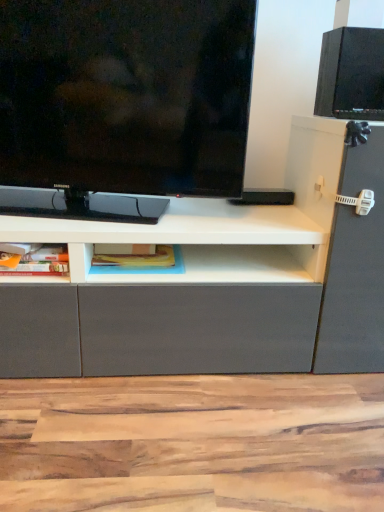
Question: Could blue matte bookshelf at center, the first cabinet positioned from the right, be considered to be inside matte black tv at upper left?

Choices:
 (A) yes
 (B) no

Answer: (B)

Question: Is matte black tv at upper left not close to blue matte bookshelf at center, the first cabinet positioned from the right?

Choices:
 (A) no
 (B) yes

Answer: (A)

Question: Could you tell me if matte black tv at upper left is turned towards blue matte bookshelf at center, acting as the 2th cabinet starting from the left?

Choices:
 (A) yes
 (B) no

Answer: (B)

Question: Is matte black tv at upper left not inside blue matte bookshelf at center, the first cabinet positioned from the right?

Choices:
 (A) no
 (B) yes

Answer: (B)

Question: Is matte black tv at upper left turned away from blue matte bookshelf at center, acting as the 2th cabinet starting from the left?

Choices:
 (A) yes
 (B) no

Answer: (B)

Question: Can you confirm if matte black tv at upper left is smaller than blue matte bookshelf at center, the first cabinet positioned from the right?

Choices:
 (A) no
 (B) yes

Answer: (A)

Question: From the image's perspective, is blue matte bookshelf at center, acting as the 2th cabinet starting from the left, on top of matte plastic container at lower left, which is the second cabinet from right to left?

Choices:
 (A) yes
 (B) no

Answer: (A)

Question: Is blue matte bookshelf at center, acting as the 2th cabinet starting from the left, positioned beyond the bounds of matte plastic container at lower left, placed as the first cabinet when sorted from left to right?

Choices:
 (A) yes
 (B) no

Answer: (A)

Question: Can you confirm if blue matte bookshelf at center, acting as the 2th cabinet starting from the left, is shorter than matte plastic container at lower left, which is the second cabinet from right to left?

Choices:
 (A) yes
 (B) no

Answer: (A)

Question: Does blue matte bookshelf at center, the first cabinet positioned from the right, appear on the left side of matte plastic container at lower left, which is the second cabinet from right to left?

Choices:
 (A) yes
 (B) no

Answer: (B)

Question: From a real-world perspective, does blue matte bookshelf at center, the first cabinet positioned from the right, stand above matte plastic container at lower left, placed as the first cabinet when sorted from left to right?

Choices:
 (A) yes
 (B) no

Answer: (B)

Question: Does blue matte bookshelf at center, acting as the 2th cabinet starting from the left, have a greater height compared to matte plastic container at lower left, placed as the first cabinet when sorted from left to right?

Choices:
 (A) yes
 (B) no

Answer: (B)

Question: Considering the relative sizes of matte plastic container at lower left, placed as the first cabinet when sorted from left to right, and blue matte bookshelf at center, the first cabinet positioned from the right, in the image provided, is matte plastic container at lower left, placed as the first cabinet when sorted from left to right, wider than blue matte bookshelf at center, the first cabinet positioned from the right,?

Choices:
 (A) yes
 (B) no

Answer: (B)